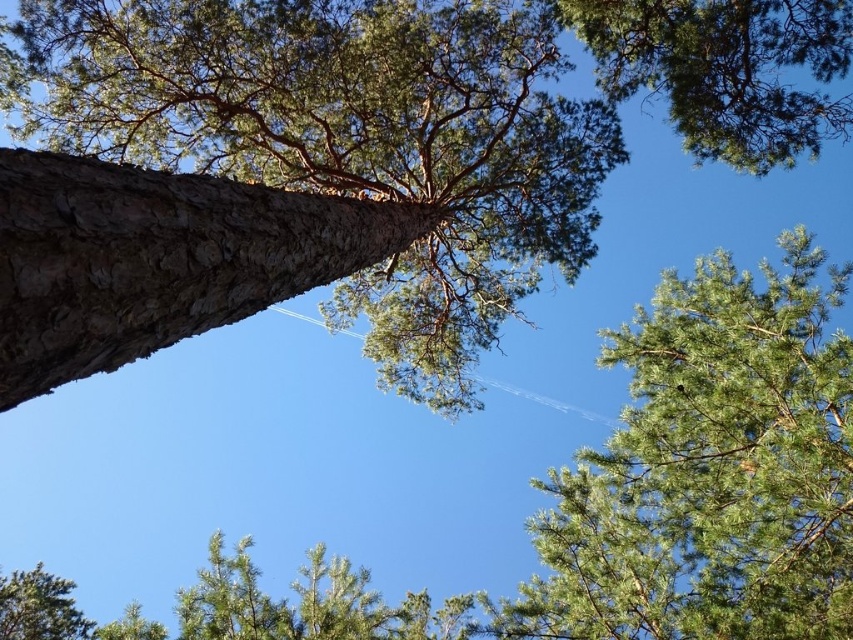
Question: Which of the following is the closest to the observer?

Choices:
 (A) green needle-like at upper center
 (B) green rough bark tree at center
 (C) green needle-like at upper right

Answer: (B)

Question: Estimate the real-world distances between objects in this image. Which object is farther from the green rough bark tree at center?

Choices:
 (A) green needle-like at upper right
 (B) green needle-like at upper center

Answer: (B)

Question: Which object appears closest to the camera in this image?

Choices:
 (A) green needle-like at upper center
 (B) green rough bark tree at center

Answer: (B)

Question: Is green rough bark tree at center further to the viewer compared to green needle-like at upper right?

Choices:
 (A) yes
 (B) no

Answer: (B)

Question: Is green rough bark tree at center positioned at the back of green needle-like at upper center?

Choices:
 (A) yes
 (B) no

Answer: (B)

Question: Where is green rough bark tree at center located in relation to green needle-like at upper right in the image?

Choices:
 (A) right
 (B) left

Answer: (B)